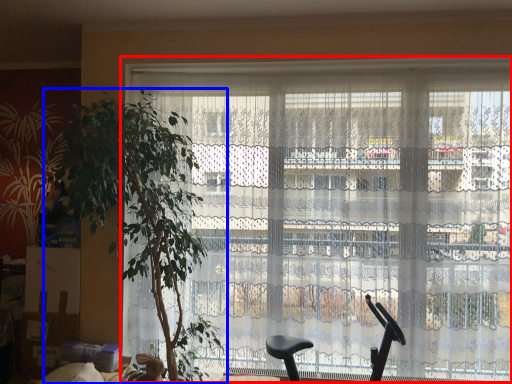
Question: Which point is further to the camera, window (highlighted by a red box) or houseplant (highlighted by a blue box)?

Choices:
 (A) window
 (B) houseplant

Answer: (A)